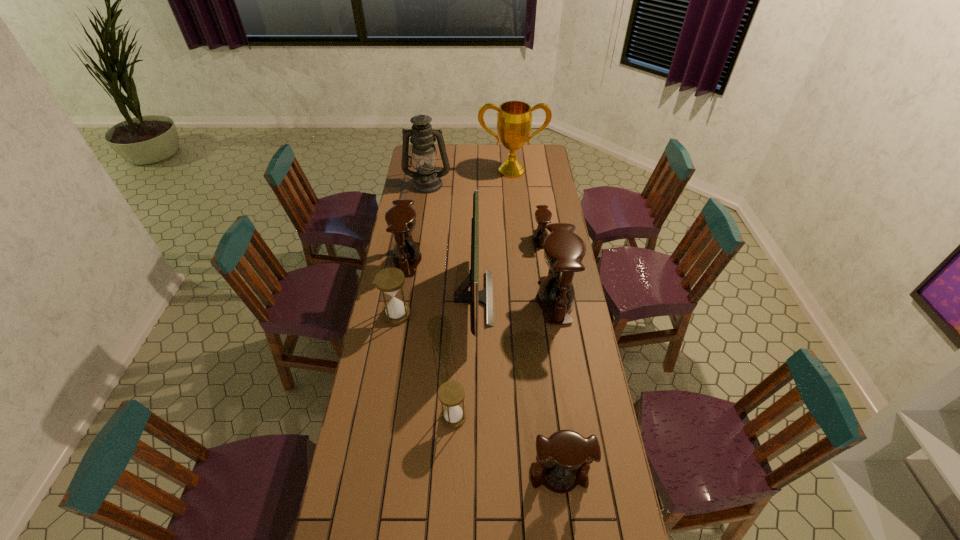
Identify the location of vacant space that satisfies the following two spatial constraints: 1. on the screen side of the monitor; 2. on the left side of the third biggest brown hourglass. This screenshot has width=960, height=540. (471, 476).

Find the location of a particular element. The height and width of the screenshot is (540, 960). vacant space that satisfies the following two spatial constraints: 1. on the back side of the sixth shortest object; 2. on the screen side of the monitor is located at coordinates (555, 298).